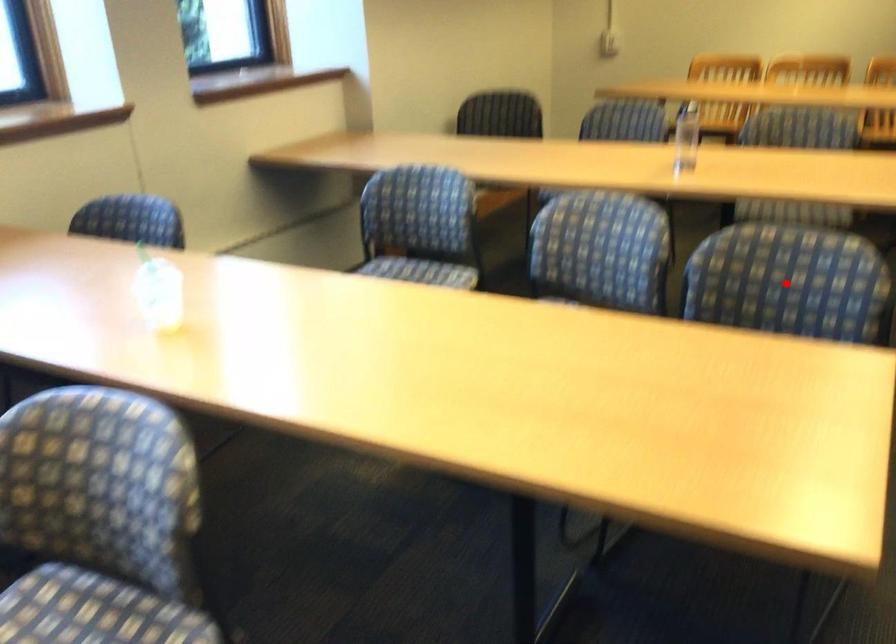
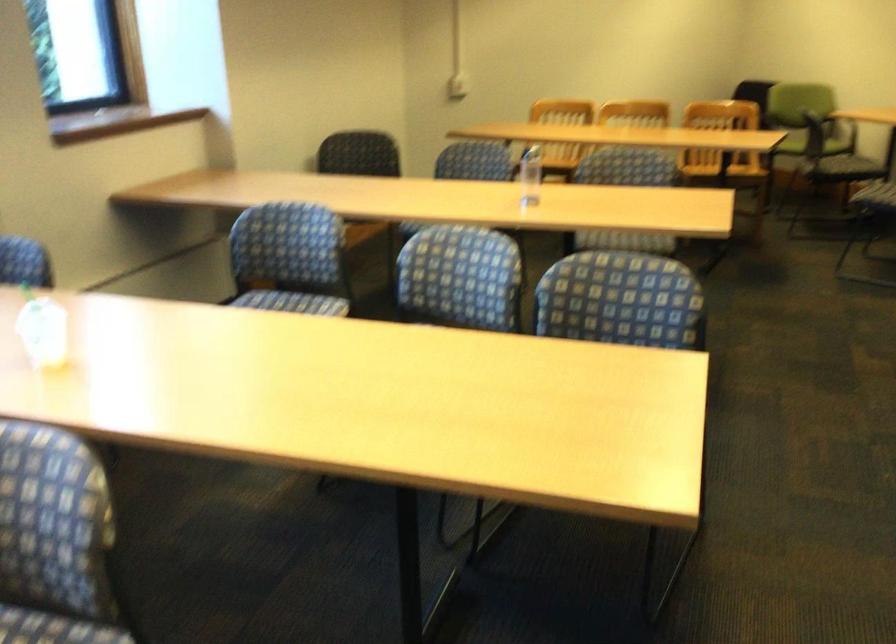
Question: A red point is marked in image1. In image2, is the corresponding 3D point closer to the camera or farther? Reply with the corresponding letter.

Choices:
 (A) The corresponding 3D point is closer.
 (B) The corresponding 3D point is farther.

Answer: (B)